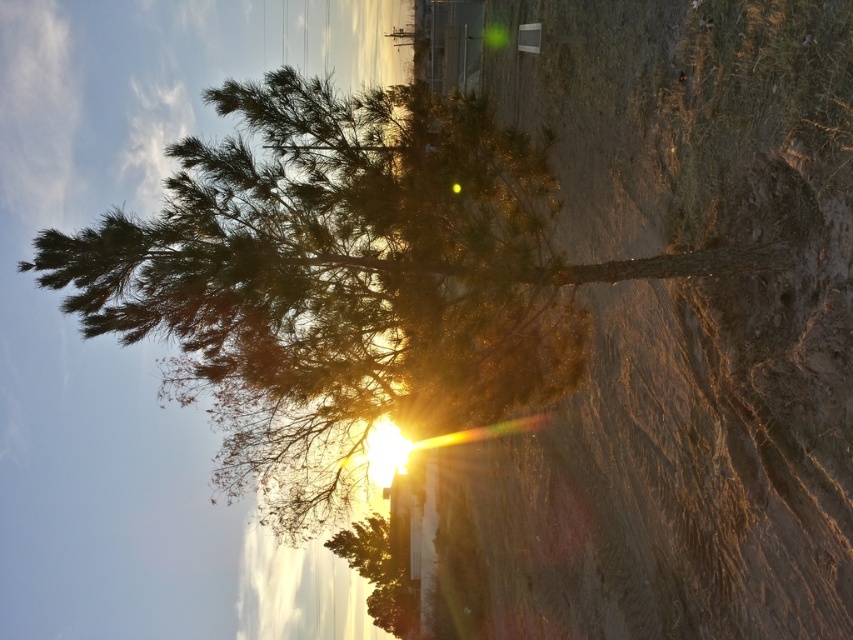
Question: Does brown dirt cliff at center have a larger size compared to green leafy tree at center?

Choices:
 (A) no
 (B) yes

Answer: (B)

Question: Which object is closer to the camera taking this photo?

Choices:
 (A) green leafy tree at center
 (B) brown dirt cliff at center

Answer: (B)

Question: Which object appears closest to the camera in this image?

Choices:
 (A) brown dirt cliff at center
 (B) green leafy tree at center

Answer: (A)

Question: Does brown dirt cliff at center appear over green leafy tree at center?

Choices:
 (A) yes
 (B) no

Answer: (B)

Question: Does brown dirt cliff at center come behind green leafy tree at center?

Choices:
 (A) yes
 (B) no

Answer: (B)